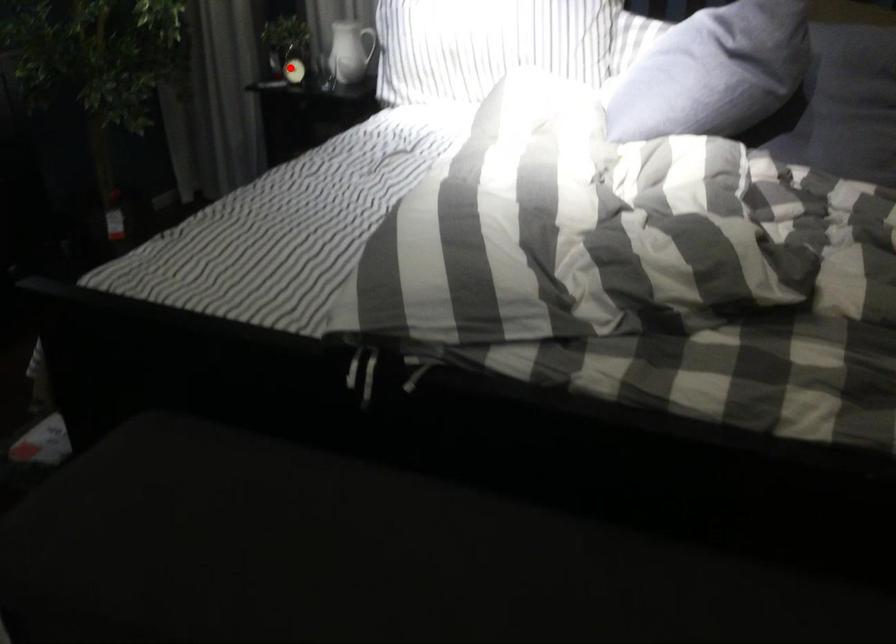
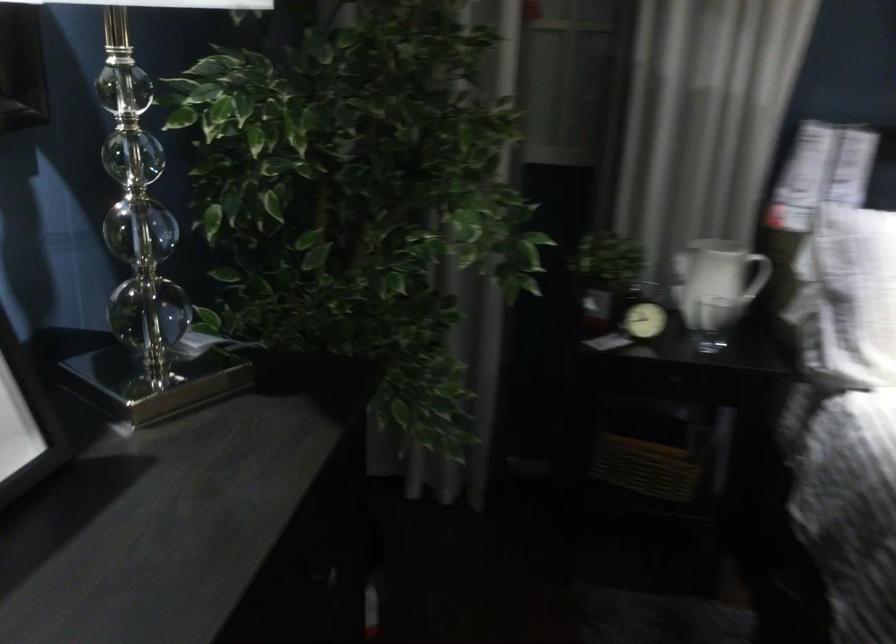
Question: I am providing you with two images of the same scene from different viewpoints. A red point is shown in image1. For the corresponding object point in image2, is it positioned nearer or farther from the camera?

Choices:
 (A) Nearer
 (B) Farther

Answer: (A)